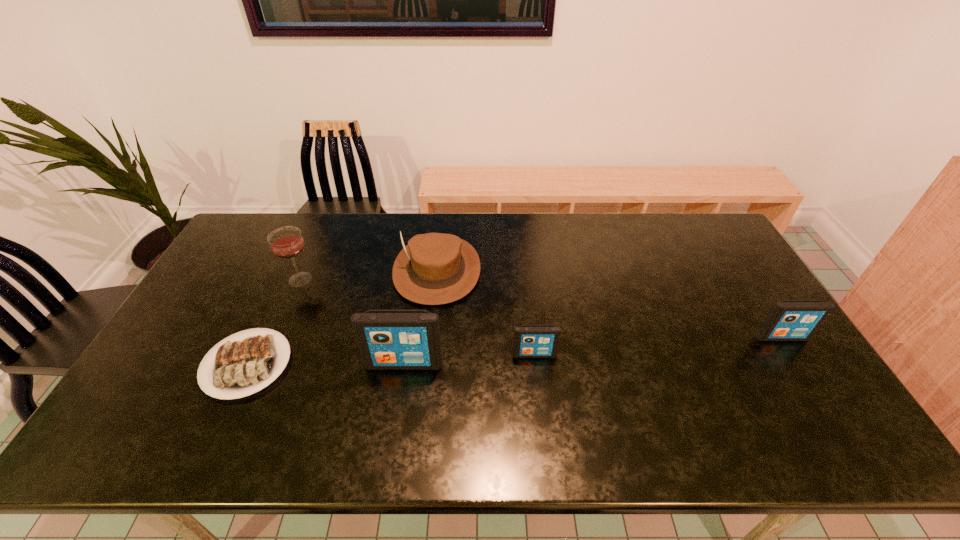
Locate an element on the screen. free point located on the front screen of the fourth tallest object is located at coordinates (794, 356).

Image resolution: width=960 pixels, height=540 pixels. I want to click on vacant space located 0.240m on the back of the wineglass, so click(x=324, y=226).

This screenshot has width=960, height=540. In order to click on free space located 0.110m on the feather side of the fedora in this screenshot , I will do `click(430, 336)`.

You are a GUI agent. You are given a task and a screenshot of the screen. Output one action in this format:
    pyautogui.click(x=<x>, y=<y>)
    Task: Click on the vacant space located 0.140m on the back of the shortest object
    This screenshot has height=540, width=960.
    Given the screenshot: What is the action you would take?
    pyautogui.click(x=280, y=293)

I want to click on object at the far edge, so click(435, 268).

The image size is (960, 540). Identify the location of object located at the near edge. (x=241, y=368).

At what (x,y) coordinates should I click in order to perform the action: click on object at the left edge. Please return your answer as a coordinate pair (x, y). The height and width of the screenshot is (540, 960). Looking at the image, I should click on (241, 368).

At what (x,y) coordinates should I click in order to perform the action: click on object present at the right edge. Please return your answer as a coordinate pair (x, y). The width and height of the screenshot is (960, 540). Looking at the image, I should click on pos(789,320).

Find the location of a particular element. The image size is (960, 540). object present at the near left corner is located at coordinates tap(241, 368).

Where is `vacant space at the far edge`? The image size is (960, 540). vacant space at the far edge is located at coordinates (639, 248).